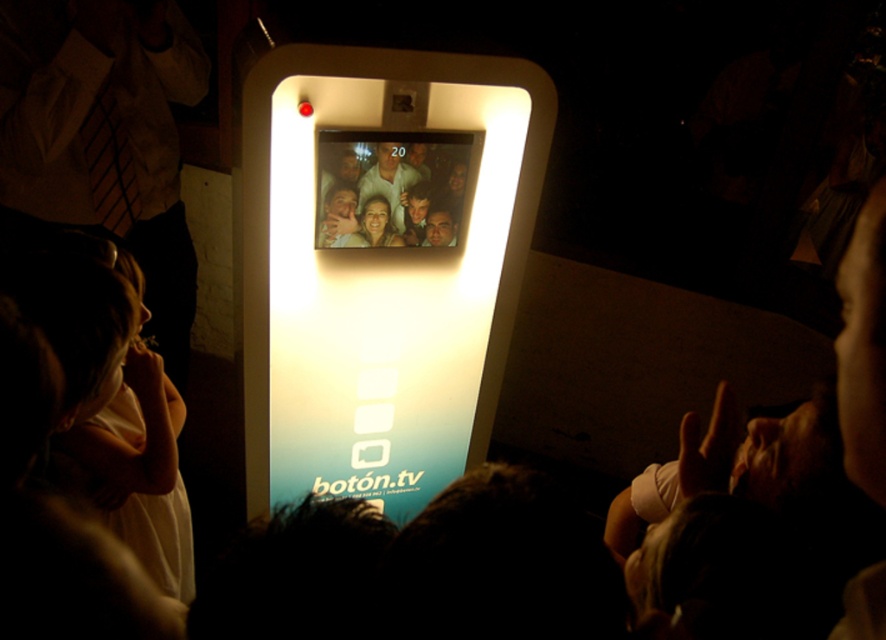
Which of these two, matte white phone at left or light pink fabric at left, stands taller?

Standing taller between the two is matte white phone at left.

Who is lower down, matte white phone at left or light pink fabric at left?

light pink fabric at left

Between point (192, 256) and point (113, 413), which one is positioned in front?

Positioned in front is point (113, 413).

This screenshot has width=886, height=640. I want to click on matte white phone at left, so click(103, 136).

Between matte white phone at left and matte white face at center, which one appears on the right side from the viewer's perspective?

From the viewer's perspective, matte white face at center appears more on the right side.

Does matte white phone at left appear over matte white face at center?

Yes.

Is point (0, 45) positioned behind point (372, 241)?

Yes, point (0, 45) is farther from viewer.

You are a GUI agent. You are given a task and a screenshot of the screen. Output one action in this format:
    pyautogui.click(x=<x>, y=<y>)
    Task: Click on the matte white phone at left
    The image size is (886, 640).
    Given the screenshot: What is the action you would take?
    pyautogui.click(x=103, y=136)

Does light pink fabric at left have a lesser width compared to matte white face at center?

In fact, light pink fabric at left might be wider than matte white face at center.

Is point (169, 397) closer to viewer compared to point (368, 244)?

No, it is not.

Where is `light pink fabric at left`? Image resolution: width=886 pixels, height=640 pixels. light pink fabric at left is located at coordinates (137, 451).